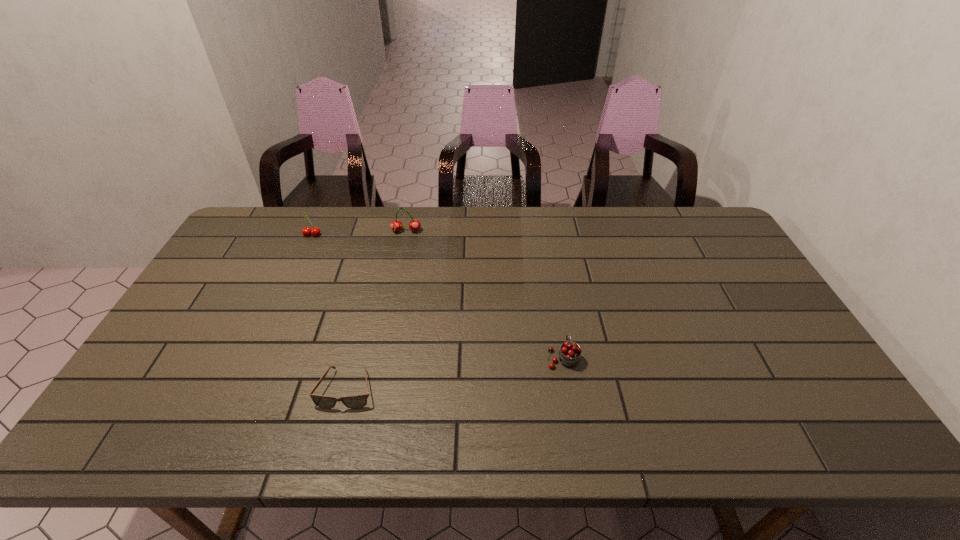
I want to click on free space located 0.280m on the handle side of the rightmost object, so pos(549,274).

The image size is (960, 540). Identify the location of free space at the far edge of the desktop. (479, 216).

In order to click on vacant space at the left edge in this screenshot , I will do `click(255, 278)`.

Locate an element on the screen. vacant space at the right edge of the desktop is located at coordinates (768, 354).

This screenshot has height=540, width=960. I want to click on vacant space that is in between the nearest cherry and the leftmost object, so click(438, 296).

Where is `empty space that is in between the tallest object and the leftmost cherry`? The height and width of the screenshot is (540, 960). empty space that is in between the tallest object and the leftmost cherry is located at coordinates (359, 233).

Locate an element on the screen. This screenshot has height=540, width=960. vacant region between the second cherry from right to left and the sunglasses is located at coordinates (376, 310).

Locate an element on the screen. vacant region between the leftmost cherry and the nearest cherry is located at coordinates (438, 296).

You are a GUI agent. You are given a task and a screenshot of the screen. Output one action in this format:
    pyautogui.click(x=<x>, y=<y>)
    Task: Click on the free point between the rightmost cherry and the shortest object
    The height and width of the screenshot is (540, 960).
    Given the screenshot: What is the action you would take?
    pyautogui.click(x=455, y=373)

Where is `free space between the leftmost cherry and the rightmost cherry`? This screenshot has width=960, height=540. free space between the leftmost cherry and the rightmost cherry is located at coordinates (438, 296).